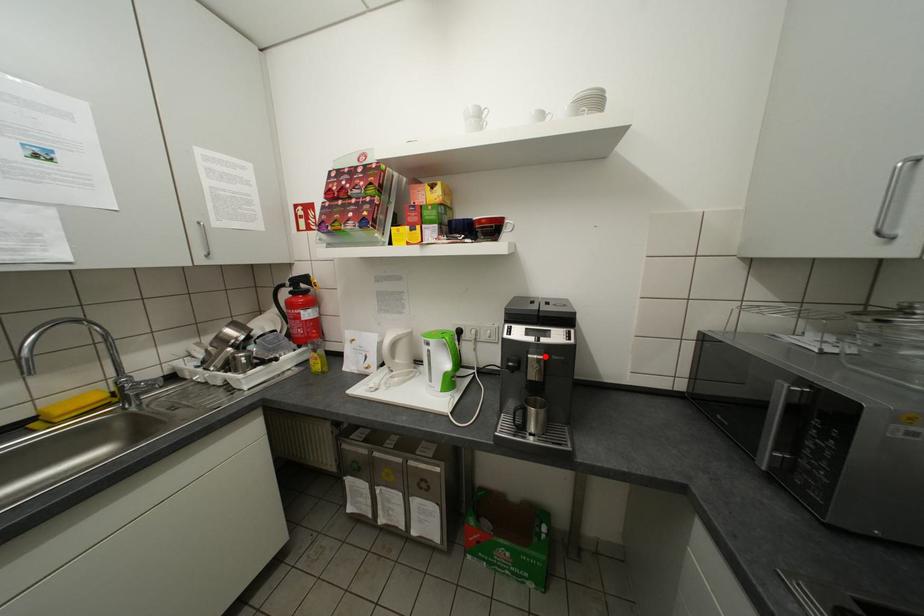
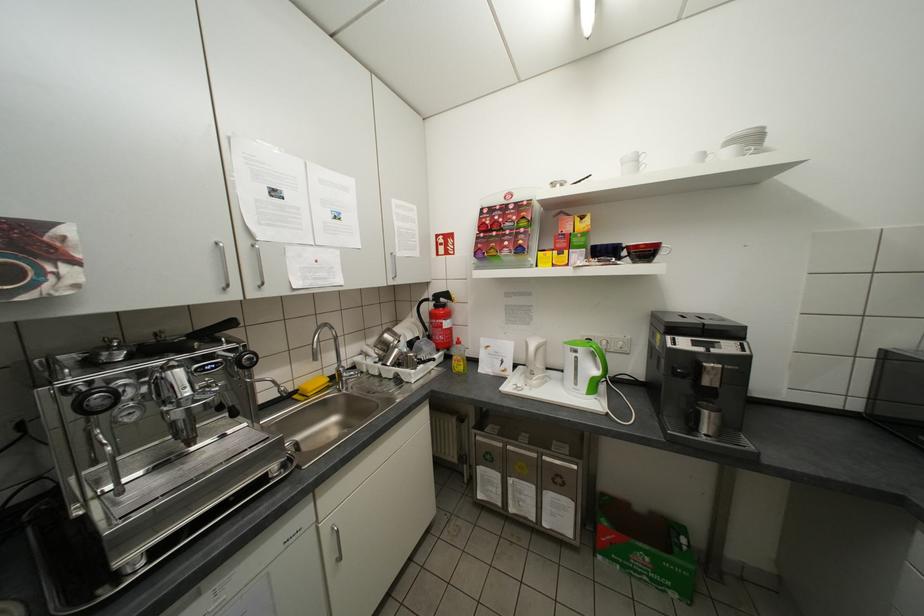
Question: I am providing you with two images of the same scene from different viewpoints. A red point is marked on the first image. At the location where the point appears in image 1, is it still visible in image 2?

Choices:
 (A) Yes
 (B) No

Answer: (A)